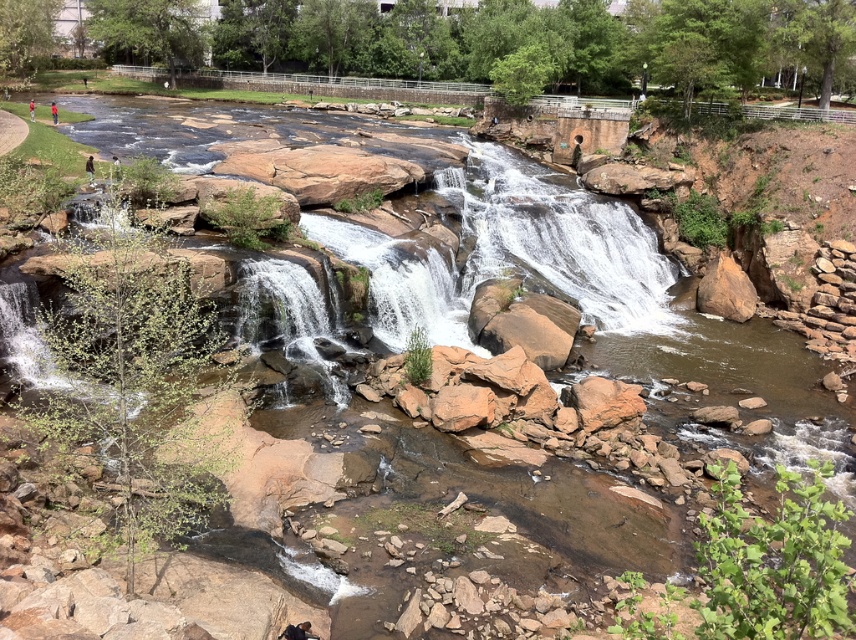
You are planning to take a photo of the white smooth waterfall at center and the green fabric person at upper left. Since you want both subjects to be clearly visible in the frame, which one should you focus on first to ensure proper depth of field?

The white smooth waterfall at center should be focused on first because it has a greater height compared to the green fabric person at upper left, so ensuring it is in focus will help both subjects be visible.

From the picture: You are planning to take a photo of the white smooth waterfall at center and the brown leather jacket at upper left. Since you want both objects in the frame, which object should you focus on to ensure they are both visible?

You should focus on the white smooth waterfall at center because its width is larger than the brown leather jacket at upper left, so it will occupy more space in the frame, making it easier to include both objects.